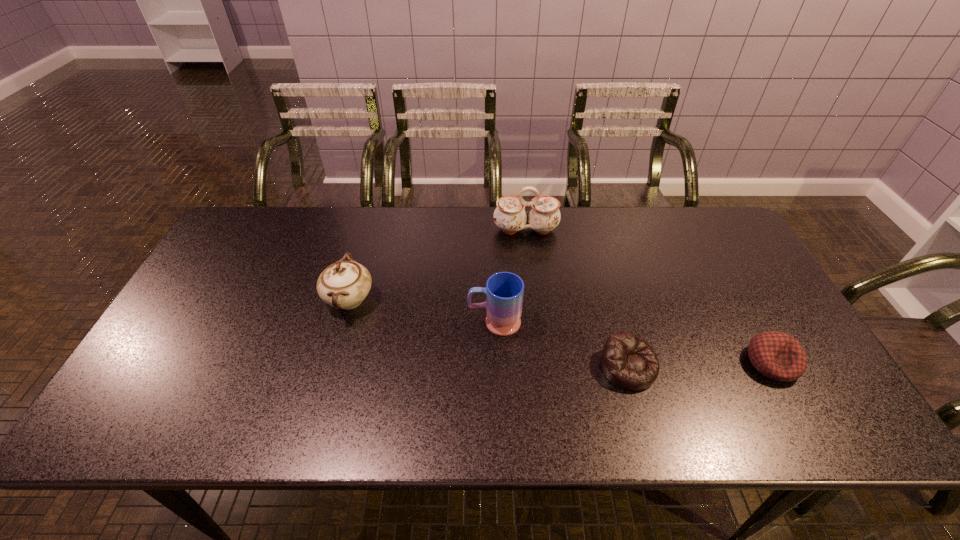
Where is `the right chinaware`? This screenshot has height=540, width=960. the right chinaware is located at coordinates (510, 216).

Identify the location of the farthest object. (510, 216).

Image resolution: width=960 pixels, height=540 pixels. Find the location of `the nearer chinaware`. the nearer chinaware is located at coordinates (345, 284).

This screenshot has width=960, height=540. What are the coordinates of `the leftmost object` in the screenshot? It's located at (345, 284).

Locate an element on the screen. mug is located at coordinates pyautogui.click(x=504, y=291).

Where is `the rightmost object`? the rightmost object is located at coordinates (778, 356).

Locate an element on the screen. The width and height of the screenshot is (960, 540). the second object from right to left is located at coordinates (628, 361).

Where is `free space located 0.200m by the handle of the farthest object`? The image size is (960, 540). free space located 0.200m by the handle of the farthest object is located at coordinates (532, 285).

What are the coordinates of `free spot located on the right of the leftmost object` in the screenshot? It's located at (482, 299).

Locate an element on the screen. The height and width of the screenshot is (540, 960). vacant space located 0.190m on the side of the mug with the handle is located at coordinates (396, 322).